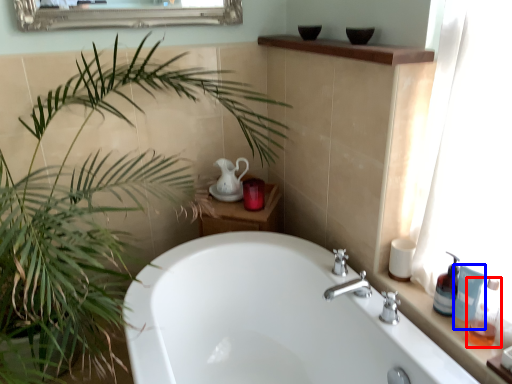
Question: Which object is closer to the camera taking this photo, soap dispenser (highlighted by a red box) or toiletry (highlighted by a blue box)?

Choices:
 (A) soap dispenser
 (B) toiletry

Answer: (A)